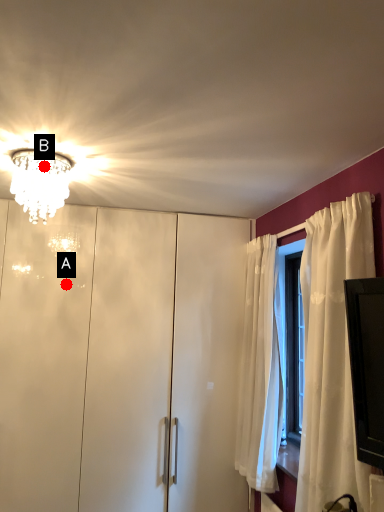
Question: Two points are circled on the image, labeled by A and B beside each circle. Which point is closer to the camera?

Choices:
 (A) A is closer
 (B) B is closer

Answer: (B)